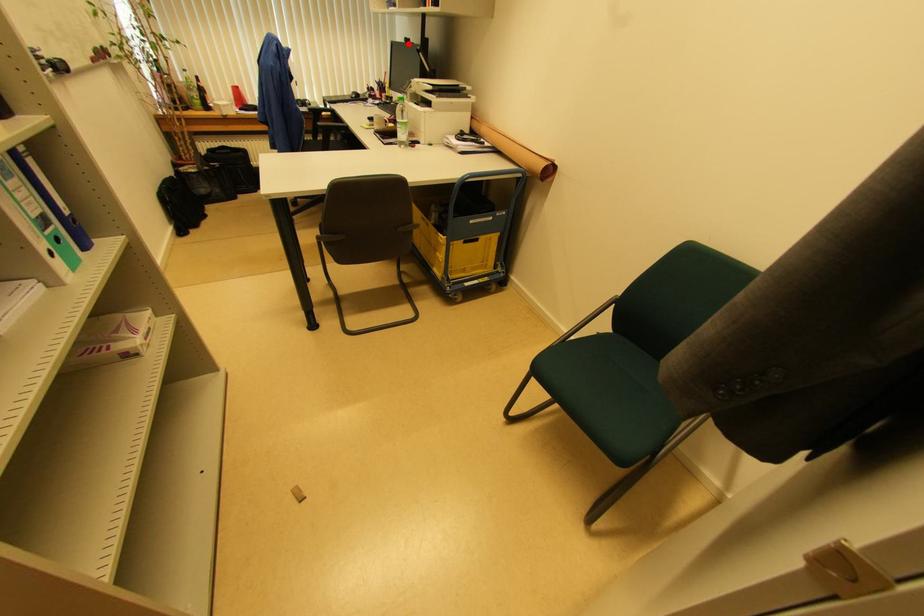
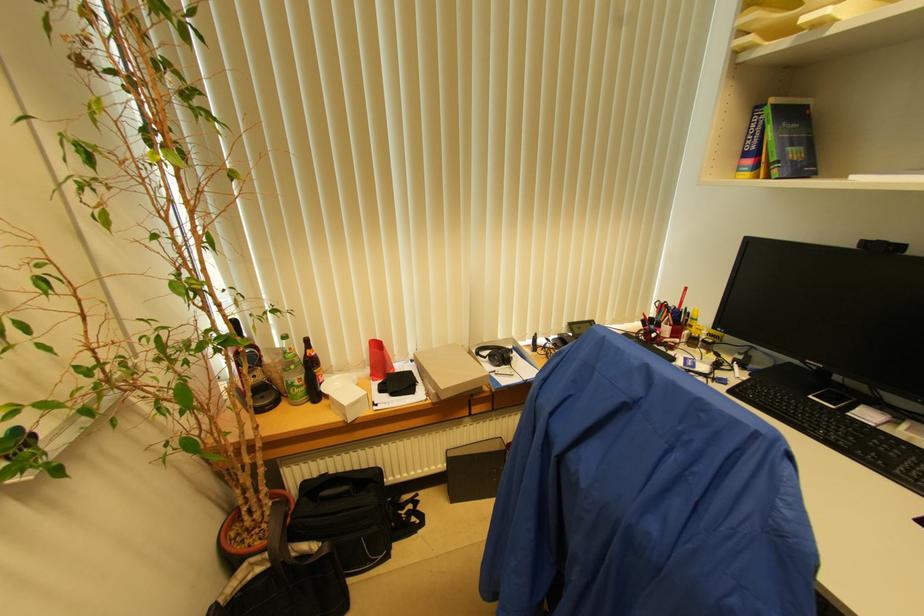
Find the pixel in the second image that matches the highlighted location in the first image.

(882, 251)